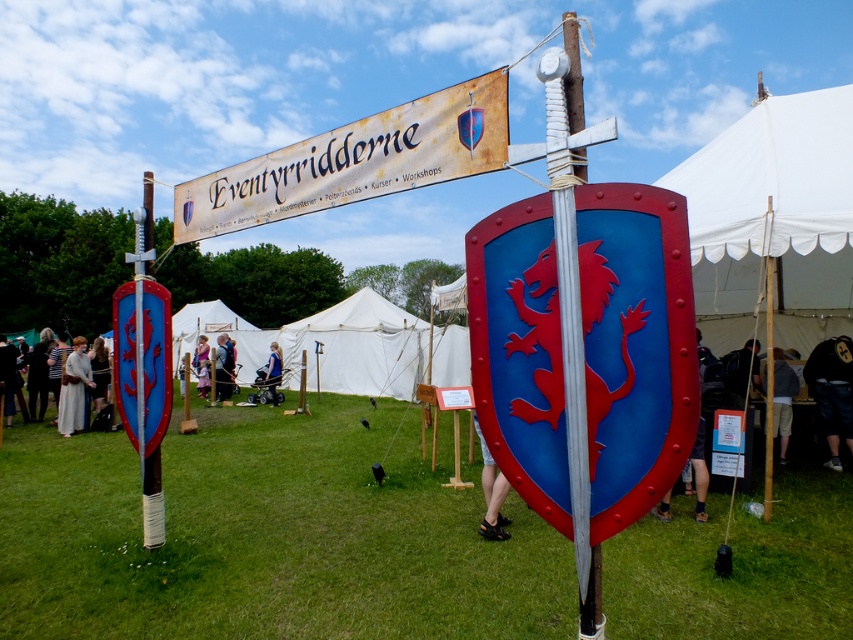
You are attending the medieval event and notice a matte black shield at center and a white linen dress at lower left. From your vantage point, which object appears closer to you?

The matte black shield at center is located below the white linen dress at lower left, so the white linen dress at lower left is closer to you.

You are attending the medieval event and see the matte black shield at center and the white linen dress at lower left. Which object is located to the right of the other?

The matte black shield at center is positioned on the right side of white linen dress at lower left.